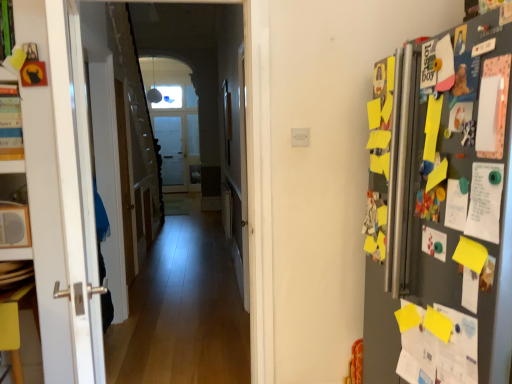
Question: Is yellow paper at lower right to the left or to the right of wooden door at center, arranged as the 1th door when viewed from the front, in the image?

Choices:
 (A) right
 (B) left

Answer: (A)

Question: Considering the positions of yellow paper at lower right and wooden door at center, arranged as the 1th door when viewed from the front, in the image, is yellow paper at lower right taller or shorter than wooden door at center, arranged as the 1th door when viewed from the front,?

Choices:
 (A) tall
 (B) short

Answer: (B)

Question: Which is farther from the yellow matte table at lower left?

Choices:
 (A) yellow paper at lower right
 (B) wooden door at center, which ranks as the second door in right-to-left order
 (C) matte white lampshade at upper center
 (D) wooden door at center, the second door when ordered from back to front
 (E) white matte speaker at left

Answer: (C)

Question: Considering the real-world distances, which object is farthest from the white matte speaker at left?

Choices:
 (A) matte white lampshade at upper center
 (B) yellow matte table at lower left
 (C) wooden floor at center
 (D) wooden door at center, the second door when ordered from back to front
 (E) wooden door at center, the first door when ordered from back to front

Answer: (A)